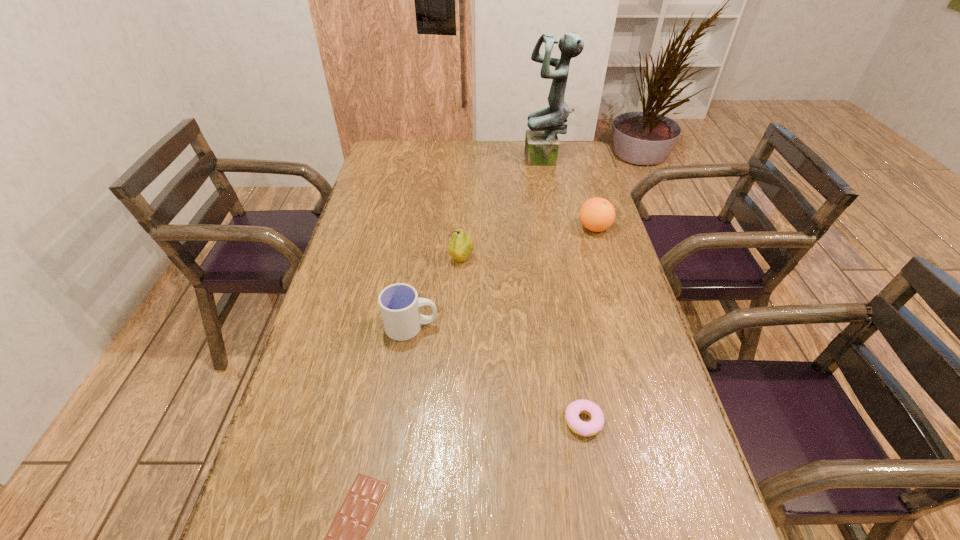
Find the location of a particular element. Image resolution: width=960 pixels, height=540 pixels. blank space at the left edge of the desktop is located at coordinates (336, 433).

In the image, there is a desktop. Identify the location of vacant space at the right edge. Image resolution: width=960 pixels, height=540 pixels. (617, 476).

This screenshot has height=540, width=960. In the image, there is a desktop. What are the coordinates of `vacant space at the far left corner` in the screenshot? It's located at (386, 160).

The width and height of the screenshot is (960, 540). I want to click on free space between the cup and the fifth nearest object, so click(x=503, y=278).

Where is `free space between the farthest object and the fourth farthest object`? This screenshot has height=540, width=960. free space between the farthest object and the fourth farthest object is located at coordinates (479, 244).

The width and height of the screenshot is (960, 540). What are the coordinates of `free space that is in between the tallest object and the orange` in the screenshot? It's located at (570, 194).

Locate an element on the screen. This screenshot has height=540, width=960. free area in between the cup and the second nearest object is located at coordinates point(497,374).

Where is `vacant point located between the third nearest object and the sculpture`? Image resolution: width=960 pixels, height=540 pixels. vacant point located between the third nearest object and the sculpture is located at coordinates (479, 244).

This screenshot has width=960, height=540. Identify the location of empty space between the orange and the tallest object. (570, 194).

This screenshot has height=540, width=960. Identify the location of object that can be found as the third closest to the fourth nearest object. (575, 408).